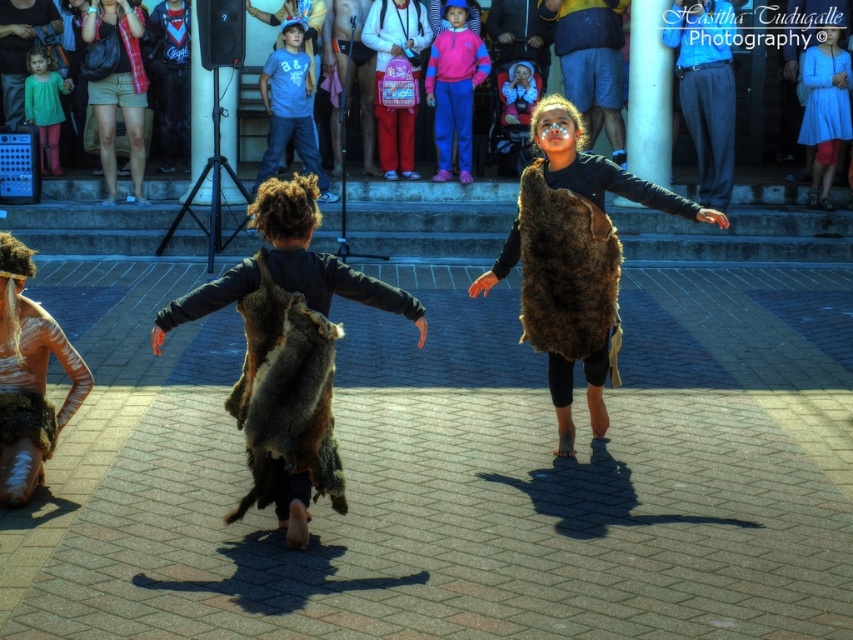
You are a photographer trying to capture the best angle of the dance performance. You notice two key points in the scene marked as point 1 at coordinates point (578, 316) and point 2 at coordinates point (305, 115). Which point should you focus on to ensure it appears larger in your photo?

Point 1 at coordinates point (578, 316) is closer to the viewer, so focusing on it will make it appear larger in the photo compared to point 2 at coordinates point (305, 115).

You are a photographer trying to capture the shadows of the children in the image. You notice a specific point marked as point (199, 106). What object is located at this point?

The point (199, 106) indicates matte black clothing at upper center.